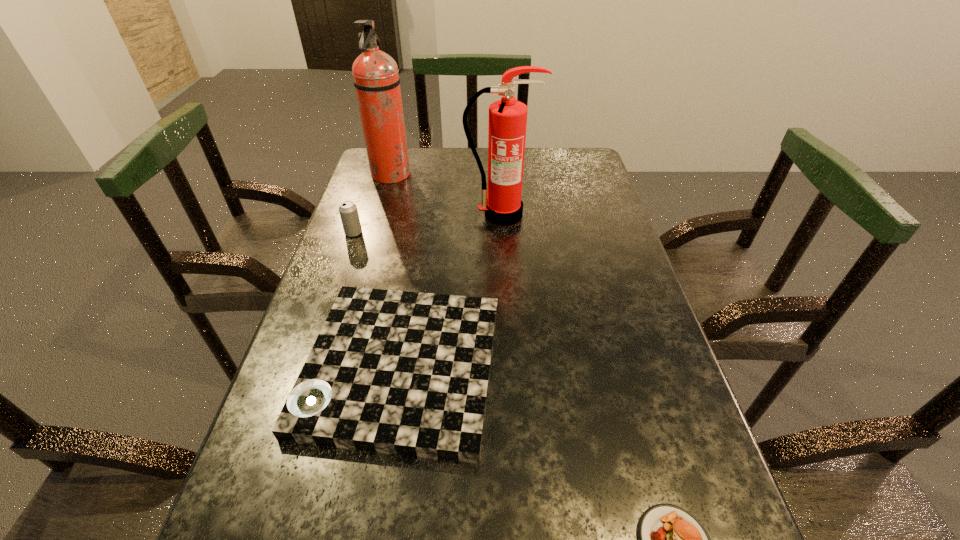
What are the coordinates of `the farther fire extinguisher` in the screenshot? It's located at click(376, 78).

Where is `the farthest object`? This screenshot has height=540, width=960. the farthest object is located at coordinates (376, 78).

You are a GUI agent. You are given a task and a screenshot of the screen. Output one action in this format:
    pyautogui.click(x=<x>, y=<y>)
    Task: Click on the right fire extinguisher
    
    Given the screenshot: What is the action you would take?
    pyautogui.click(x=507, y=117)

Image resolution: width=960 pixels, height=540 pixels. I want to click on the nearer fire extinguisher, so 507,117.

Locate an element on the screen. This screenshot has height=540, width=960. the third tallest object is located at coordinates (348, 211).

Find the location of `the third nearest object`. the third nearest object is located at coordinates (348, 211).

Identify the location of the fourth farthest object. (407, 373).

Locate an element on the screen. vacant space situated 0.150m at the nozzle of the farther fire extinguisher is located at coordinates (458, 175).

Locate an element on the screen. Image resolution: width=960 pixels, height=540 pixels. vacant space located 0.140m with the nozzle aimed from the fourth nearest object is located at coordinates (504, 260).

Where is `free space located on the back of the beer can`? The height and width of the screenshot is (540, 960). free space located on the back of the beer can is located at coordinates (379, 159).